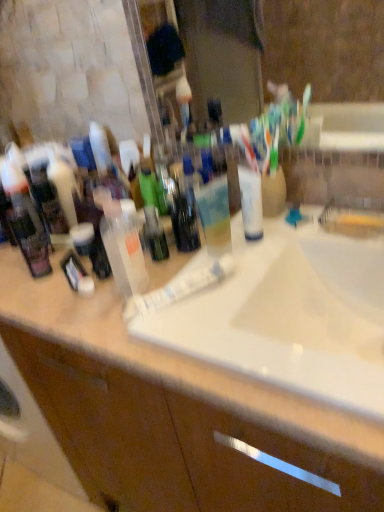
Find the location of a particular element. The height and width of the screenshot is (512, 384). vacant region to the left of translucent plastic tube at left, the fourth toiletry positioned from the right is located at coordinates (12, 276).